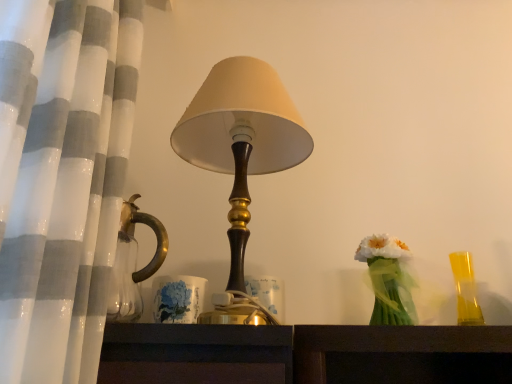
What is the approximate height of white sheer curtain at left?

1.07 meters.

Describe the element at coordinates (62, 221) in the screenshot. This screenshot has width=512, height=384. I see `white sheer curtain at left` at that location.

Where is `translucent yellow glass at right`? The width and height of the screenshot is (512, 384). translucent yellow glass at right is located at coordinates (465, 289).

Find the location of `translucent green vase at right`. translucent green vase at right is located at coordinates (388, 280).

Image resolution: width=512 pixels, height=384 pixels. What do you see at coordinates (241, 138) in the screenshot? I see `matte brown lampshade at center` at bounding box center [241, 138].

Identify the location of white sheer curtain at left. (62, 221).

Consider the image. Are translucent green vase at right and white sheer curtain at left making contact?

No, translucent green vase at right is not making contact with white sheer curtain at left.

How different are the orientations of translucent green vase at right and white sheer curtain at left in degrees?

The angle between the facing direction of translucent green vase at right and the facing direction of white sheer curtain at left is 90.5 degrees.

From the image's perspective, is translucent green vase at right over white sheer curtain at left?

No, from the image's perspective, translucent green vase at right is not over white sheer curtain at left.

Considering the relative sizes of translucent green vase at right and white sheer curtain at left in the image provided, is translucent green vase at right bigger than white sheer curtain at left?

No, translucent green vase at right is not bigger than white sheer curtain at left.

Considering the positions of point (182, 142) and point (36, 306), is point (182, 142) closer or farther from the camera than point (36, 306)?

Point (182, 142) is farther from the camera than point (36, 306).

In the image, is matte brown lampshade at center positioned in front of or behind white sheer curtain at left?

matte brown lampshade at center is behind white sheer curtain at left.

From their relative heights in the image, would you say matte brown lampshade at center is taller or shorter than white sheer curtain at left?

matte brown lampshade at center is shorter than white sheer curtain at left.

Is matte brown lampshade at center aimed at white sheer curtain at left?

No.

From the image's perspective, would you say matte brown lampshade at center is positioned over translucent green vase at right?

Yes, from the image's perspective, matte brown lampshade at center is over translucent green vase at right.

Based on the photo, from a real-world perspective, which is physically below, matte brown lampshade at center or translucent green vase at right?

translucent green vase at right, from a real-world perspective.

Which object is further away from the camera taking this photo, matte brown lampshade at center or translucent green vase at right?

translucent green vase at right is more distant.

Locate an element on the screen. The height and width of the screenshot is (384, 512). floral arrangement below the matte brown lampshade at center (from the image's perspective) is located at coordinates (388, 280).

Considering the positions of objects white sheer curtain at left and translucent green vase at right in the image provided, who is in front, white sheer curtain at left or translucent green vase at right?

white sheer curtain at left is closer to the camera.

Which is correct: white sheer curtain at left is inside translucent green vase at right, or outside of it?

white sheer curtain at left exists outside the volume of translucent green vase at right.

How many degrees apart are the facing directions of white sheer curtain at left and translucent green vase at right?

The angular difference between white sheer curtain at left and translucent green vase at right is 90.5 degrees.

Is white sheer curtain at left not within matte brown lampshade at center?

That's correct, white sheer curtain at left is outside of matte brown lampshade at center.

Could you tell me if white sheer curtain at left is turned towards matte brown lampshade at center?

Yes.

From a real-world perspective, who is located higher, white sheer curtain at left or matte brown lampshade at center?

white sheer curtain at left.

Considering the sizes of objects white sheer curtain at left and translucent yellow glass at right in the image provided, who is wider, white sheer curtain at left or translucent yellow glass at right?

With larger width is white sheer curtain at left.

Is white sheer curtain at left to the right of translucent yellow glass at right from the viewer's perspective?

In fact, white sheer curtain at left is to the left of translucent yellow glass at right.

Considering the relative sizes of white sheer curtain at left and translucent yellow glass at right in the image provided, is white sheer curtain at left smaller than translucent yellow glass at right?

Actually, white sheer curtain at left might be larger than translucent yellow glass at right.

Considering the relative positions of matte brown lampshade at center and translucent yellow glass at right in the image provided, is matte brown lampshade at center to the right of translucent yellow glass at right from the viewer's perspective?

Incorrect, matte brown lampshade at center is not on the right side of translucent yellow glass at right.

In the image, is matte brown lampshade at center positioned in front of or behind translucent yellow glass at right?

In the image, matte brown lampshade at center appears in front of translucent yellow glass at right.

Find the location of `lamp above the translucent yellow glass at right (from the image's perspective)`. lamp above the translucent yellow glass at right (from the image's perspective) is located at coordinates (241, 138).

Looking at this image, is translucent yellow glass at right located within matte brown lampshade at center?

Actually, translucent yellow glass at right is outside matte brown lampshade at center.

Where is `floral arrangement behind the white sheer curtain at left`? The height and width of the screenshot is (384, 512). floral arrangement behind the white sheer curtain at left is located at coordinates (388, 280).

Locate an element on the screen. lamp lying on the right of white sheer curtain at left is located at coordinates (241, 138).

Estimate the real-world distances between objects in this image. Which object is further from white sheer curtain at left, translucent green vase at right or translucent yellow glass at right?

Based on the image, translucent yellow glass at right appears to be further to white sheer curtain at left.

Which object lies further to the anchor point translucent green vase at right, matte brown lampshade at center or translucent yellow glass at right?

matte brown lampshade at center is further to translucent green vase at right.

Looking at the image, which one is located closer to matte brown lampshade at center, white sheer curtain at left or translucent yellow glass at right?

white sheer curtain at left is closer to matte brown lampshade at center.

When comparing their distances from translucent green vase at right, does white sheer curtain at left or matte brown lampshade at center seem closer?

matte brown lampshade at center is positioned closer to the anchor translucent green vase at right.

Estimate the real-world distances between objects in this image. Which object is closer to translucent yellow glass at right, white sheer curtain at left or matte brown lampshade at center?

matte brown lampshade at center lies closer to translucent yellow glass at right than the other object.

Based on the photo, which object lies further to the anchor point white sheer curtain at left, translucent green vase at right or matte brown lampshade at center?

translucent green vase at right lies further to white sheer curtain at left than the other object.

Looking at the image, which one is located closer to white sheer curtain at left, matte brown lampshade at center or translucent yellow glass at right?

Based on the image, matte brown lampshade at center appears to be nearer to white sheer curtain at left.

Which object lies further to the anchor point translucent yellow glass at right, matte brown lampshade at center or white sheer curtain at left?

white sheer curtain at left is further to translucent yellow glass at right.

At what (x,y) coordinates should I click in order to perform the action: click on lamp between white sheer curtain at left and translucent yellow glass at right. Please return your answer as a coordinate pair (x, y). The height and width of the screenshot is (384, 512). Looking at the image, I should click on (241, 138).

Image resolution: width=512 pixels, height=384 pixels. Identify the location of floral arrangement between matte brown lampshade at center and translucent yellow glass at right. [x=388, y=280].

Find the location of a particular element. floral arrangement between white sheer curtain at left and translucent yellow glass at right is located at coordinates (388, 280).

You are a GUI agent. You are given a task and a screenshot of the screen. Output one action in this format:
    pyautogui.click(x=<x>, y=<y>)
    Task: Click on the lamp between white sheer curtain at left and translucent green vase at right in the front-back direction
    The width and height of the screenshot is (512, 384).
    Given the screenshot: What is the action you would take?
    pyautogui.click(x=241, y=138)